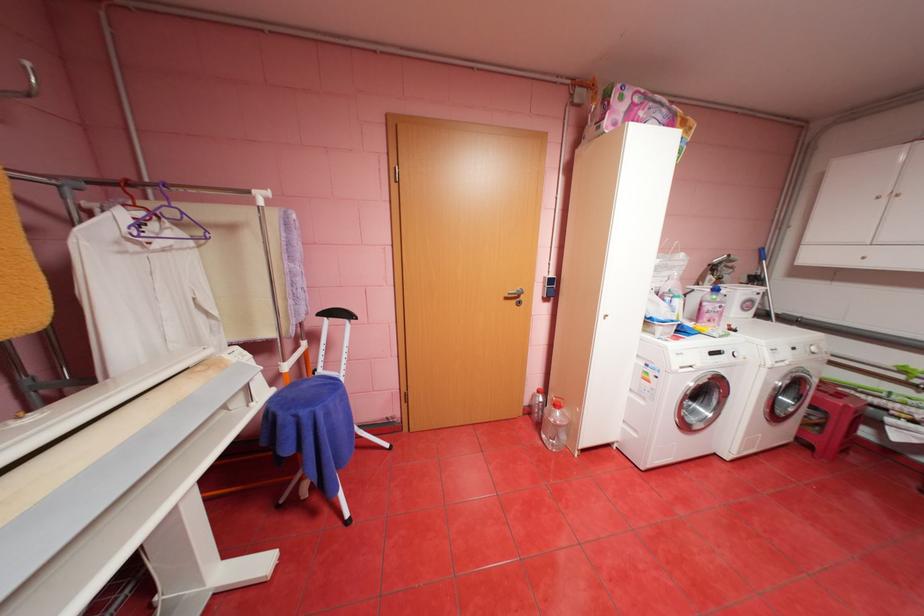
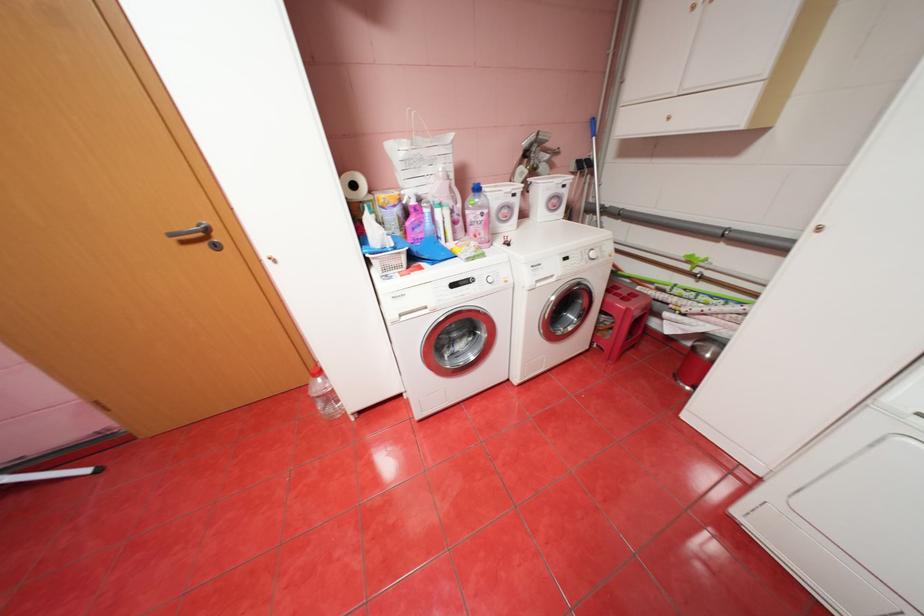
In the second image, find the point that corresponds to point 523,301 in the first image.

(213, 245)